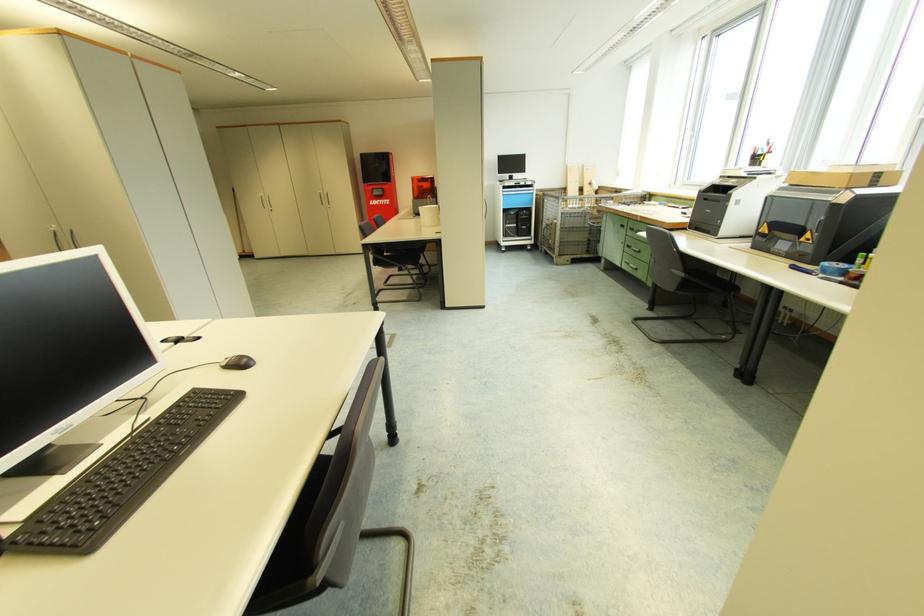
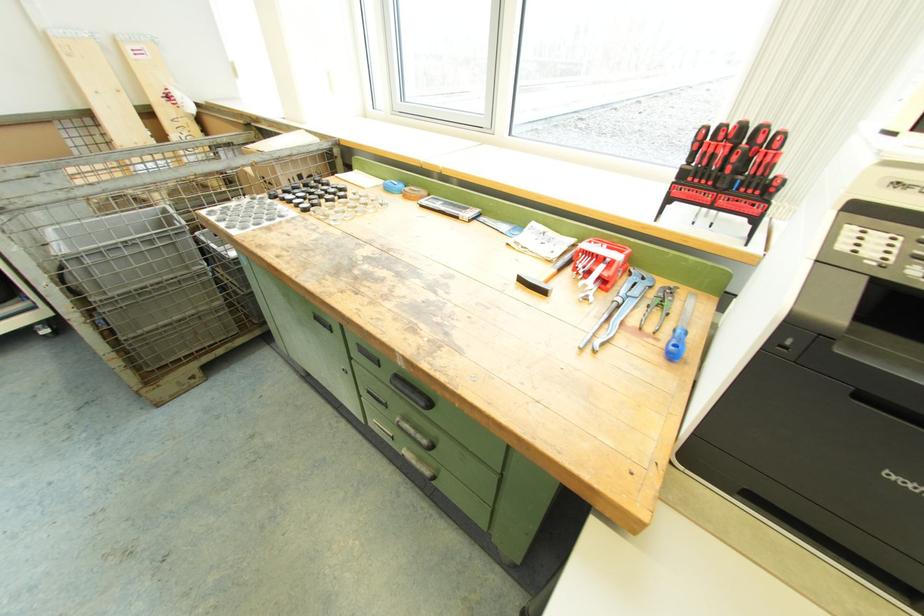
Find the pixel in the second image that matches point (663, 205) in the first image.

(391, 188)